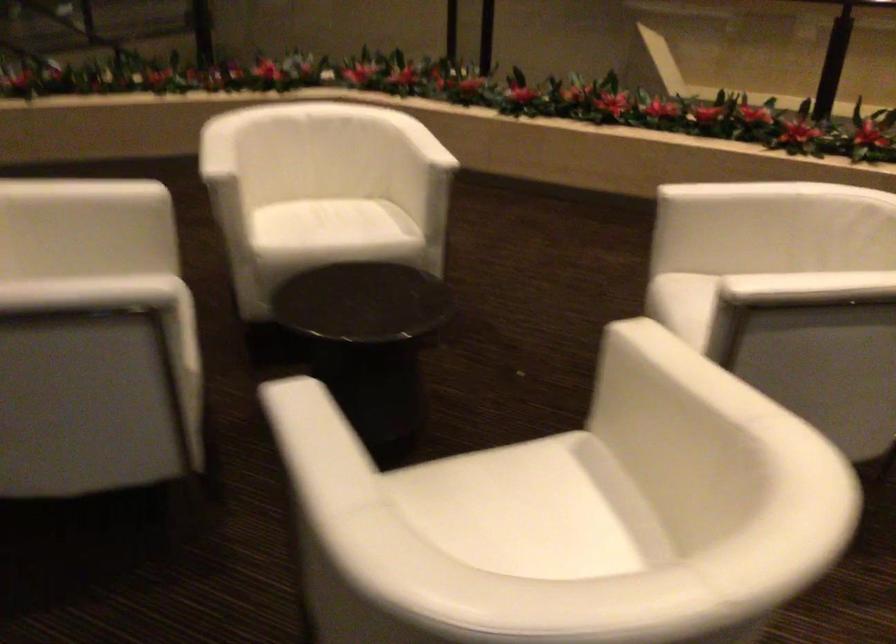
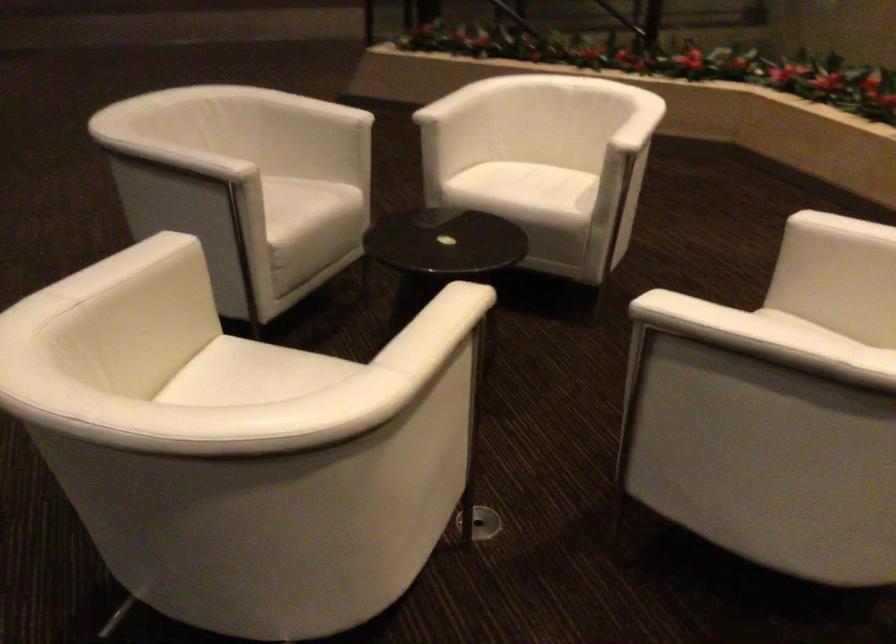
In the second image, find the point that corresponds to (x=444, y=512) in the first image.

(252, 375)